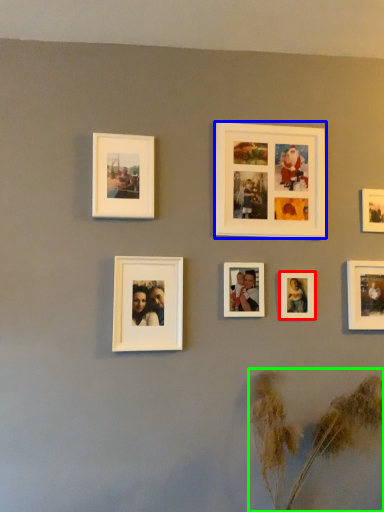
Question: Which object is the farthest from picture frame (highlighted by a red box)? Choose among these: picture frame (highlighted by a blue box) or plant (highlighted by a green box).

Choices:
 (A) picture frame
 (B) plant

Answer: (B)